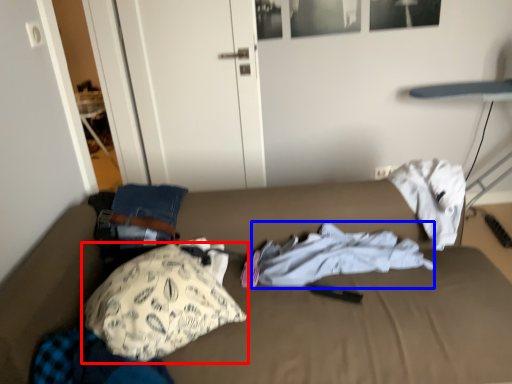
Question: Among these objects, which one is nearest to the camera, pillow (highlighted by a red box) or clothing (highlighted by a blue box)?

Choices:
 (A) pillow
 (B) clothing

Answer: (A)